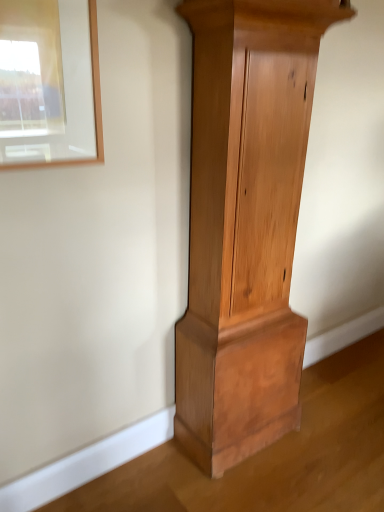
Locate an element on the screen. The height and width of the screenshot is (512, 384). free location to the right of natural wood cupboard at center is located at coordinates [x=333, y=431].